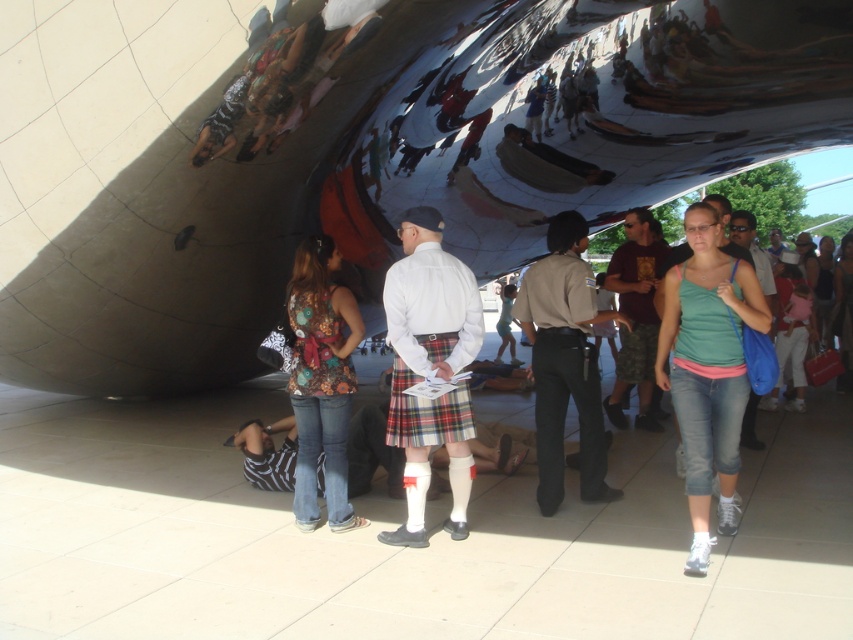
Is green cotton tank top at center positioned before matte black shirt at center?

That is True.

Which is more to the right, green cotton tank top at center or matte black shirt at center?

Positioned to the right is matte black shirt at center.

Between point (711, 228) and point (821, 308), which one is positioned behind?

Point (821, 308)

At what (x,y) coordinates should I click in order to perform the action: click on green cotton tank top at center. Please return your answer as a coordinate pair (x, y). This screenshot has height=640, width=853. Looking at the image, I should click on (708, 369).

Who is positioned more to the right, green cotton tank top at center or matte green tank top at center?

Positioned to the right is matte green tank top at center.

Is green cotton tank top at center thinner than matte green tank top at center?

Yes.

At what (x,y) coordinates should I click in order to perform the action: click on green cotton tank top at center. Please return your answer as a coordinate pair (x, y). Looking at the image, I should click on (708, 369).

Locate an element on the screen. The width and height of the screenshot is (853, 640). green cotton tank top at center is located at coordinates (708, 369).

What do you see at coordinates (321, 380) in the screenshot? I see `floral-patterned fabric at lower left` at bounding box center [321, 380].

Who is positioned more to the right, floral-patterned fabric at lower left or matte green tank top at center?

matte green tank top at center is more to the right.

You are a GUI agent. You are given a task and a screenshot of the screen. Output one action in this format:
    pyautogui.click(x=<x>, y=<y>)
    Task: Click on the floral-patterned fabric at lower left
    The image size is (853, 640).
    Given the screenshot: What is the action you would take?
    pyautogui.click(x=321, y=380)